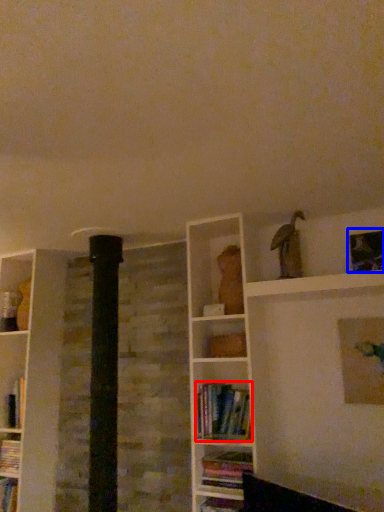
Question: Among these objects, which one is nearest to the camera, book (highlighted by a red box) or picture frame (highlighted by a blue box)?

Choices:
 (A) book
 (B) picture frame

Answer: (A)